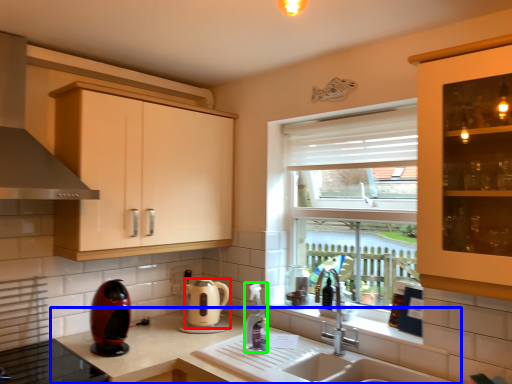
Question: Which is farther away from kitchen appliance (highlighted by a red box)? countertop (highlighted by a blue box) or bottle (highlighted by a green box)?

Choices:
 (A) countertop
 (B) bottle

Answer: (B)